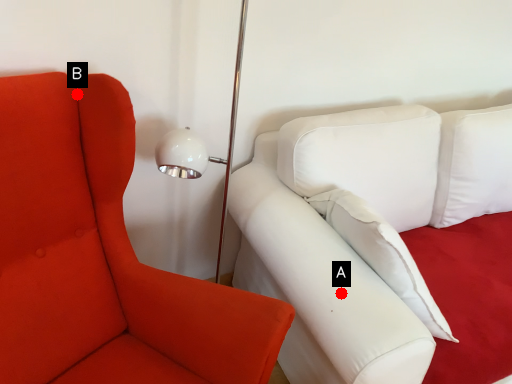
Question: Two points are circled on the image, labeled by A and B beside each circle. Which of the following is the closest to the observer?

Choices:
 (A) A is closer
 (B) B is closer

Answer: (B)